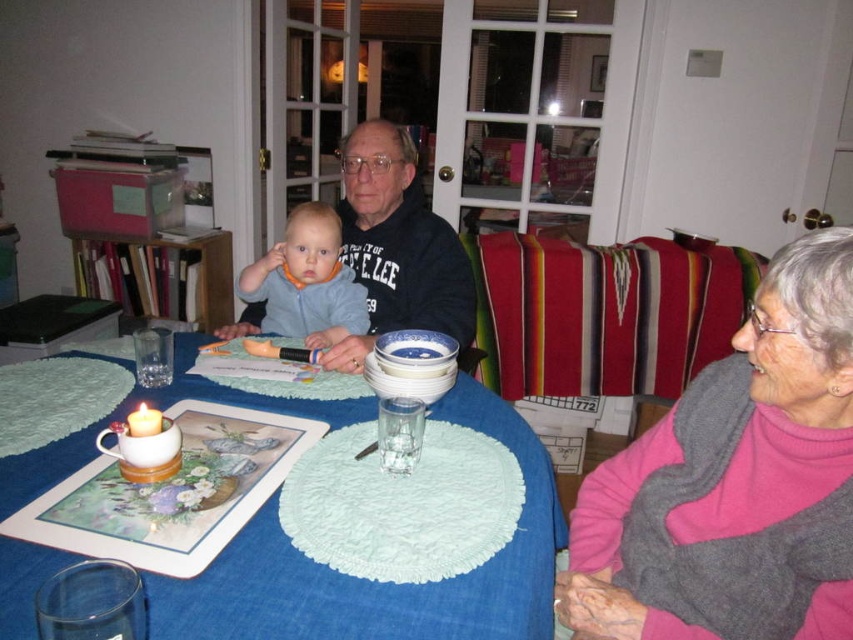
Between blue fabric table at center and light blue fabric bib at center, which one appears on the right side from the viewer's perspective?

blue fabric table at center

Is blue fabric table at center to the right of light blue fabric bib at center from the viewer's perspective?

Correct, you'll find blue fabric table at center to the right of light blue fabric bib at center.

Where is `blue fabric table at center`? This screenshot has height=640, width=853. blue fabric table at center is located at coordinates (378, 582).

Is matte black sweater at center bigger than light blue fabric bib at center?

Indeed, matte black sweater at center has a larger size compared to light blue fabric bib at center.

From the picture: Does matte black sweater at center have a greater width compared to light blue fabric bib at center?

Correct, the width of matte black sweater at center exceeds that of light blue fabric bib at center.

At what (x,y) coordinates should I click in order to perform the action: click on matte black sweater at center. Please return your answer as a coordinate pair (x, y). Looking at the image, I should click on (397, 246).

Can you confirm if pink wool sweater at upper right is positioned to the right of light blue fabric bib at center?

Indeed, pink wool sweater at upper right is positioned on the right side of light blue fabric bib at center.

Can you confirm if pink wool sweater at upper right is positioned below light blue fabric bib at center?

Yes.

Where is `pink wool sweater at upper right`? The image size is (853, 640). pink wool sweater at upper right is located at coordinates pyautogui.click(x=735, y=474).